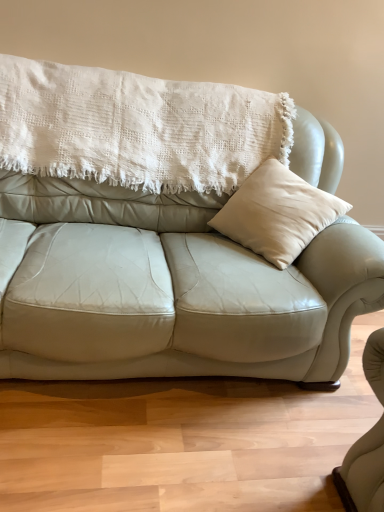
This screenshot has width=384, height=512. What do you see at coordinates (168, 233) in the screenshot?
I see `light beige leather couch at center` at bounding box center [168, 233].

Image resolution: width=384 pixels, height=512 pixels. I want to click on light beige leather couch at center, so click(168, 233).

What do you see at coordinates (137, 128) in the screenshot? The height and width of the screenshot is (512, 384). I see `white textured blanket at upper center` at bounding box center [137, 128].

Where is `white textured blanket at upper center`? The height and width of the screenshot is (512, 384). white textured blanket at upper center is located at coordinates (137, 128).

Where is `light beige leather couch at center`? The image size is (384, 512). light beige leather couch at center is located at coordinates (168, 233).

Is light beige leather couch at center at the right side of white textured blanket at upper center?

Yes.

In the image, is light beige leather couch at center positioned in front of or behind white textured blanket at upper center?

Clearly, light beige leather couch at center is in front of white textured blanket at upper center.

Is point (248, 293) closer to viewer compared to point (252, 168)?

That is True.

From the image's perspective, which is below, light beige leather couch at center or white textured blanket at upper center?

light beige leather couch at center, from the image's perspective.

From a real-world perspective, is light beige leather couch at center under white textured blanket at upper center?

Yes, from a real-world perspective, light beige leather couch at center is under white textured blanket at upper center.

Does light beige leather couch at center have a greater width compared to white textured blanket at upper center?

Yes, light beige leather couch at center is wider than white textured blanket at upper center.

Considering the sizes of objects light beige leather couch at center and white textured blanket at upper center in the image provided, who is taller, light beige leather couch at center or white textured blanket at upper center?

light beige leather couch at center is taller.

Who is smaller, light beige leather couch at center or white textured blanket at upper center?

white textured blanket at upper center.

Do you think light beige leather couch at center is within white textured blanket at upper center, or outside of it?

light beige leather couch at center lies outside white textured blanket at upper center.

Is there a large distance between light beige leather couch at center and white textured blanket at upper center?

That's not correct — light beige leather couch at center is a little close to white textured blanket at upper center.

Is light beige leather couch at center aimed at white textured blanket at upper center?

No, light beige leather couch at center does not turn towards white textured blanket at upper center.

Find the location of a particular element. blanket on the left of light beige leather couch at center is located at coordinates (137, 128).

Can you confirm if white textured blanket at upper center is positioned to the right of light beige leather couch at center?

In fact, white textured blanket at upper center is to the left of light beige leather couch at center.

Who is more distant, white textured blanket at upper center or light beige leather couch at center?

white textured blanket at upper center is further from the camera.

Between point (258, 116) and point (41, 206), which one is positioned in front?

The point (41, 206) is in front.

From the image's perspective, which one is positioned lower, white textured blanket at upper center or light beige leather couch at center?

light beige leather couch at center is shown below in the image.

From a real-world perspective, who is located lower, white textured blanket at upper center or light beige leather couch at center?

In real-world perspective, light beige leather couch at center is lower.

Considering the relative sizes of white textured blanket at upper center and light beige leather couch at center in the image provided, is white textured blanket at upper center thinner than light beige leather couch at center?

Indeed, white textured blanket at upper center has a lesser width compared to light beige leather couch at center.

Does white textured blanket at upper center have a lesser height compared to light beige leather couch at center?

Indeed, white textured blanket at upper center has a lesser height compared to light beige leather couch at center.

Considering the sizes of objects white textured blanket at upper center and light beige leather couch at center in the image provided, who is bigger, white textured blanket at upper center or light beige leather couch at center?

light beige leather couch at center is bigger.

Is white textured blanket at upper center situated inside light beige leather couch at center or outside?

The correct answer is: inside.

Would you consider white textured blanket at upper center to be distant from light beige leather couch at center?

No.

Is white textured blanket at upper center turned away from light beige leather couch at center?

That's right, white textured blanket at upper center is facing away from light beige leather couch at center.

Identify the location of blanket above the light beige leather couch at center (from a real-world perspective). The image size is (384, 512). (137, 128).

This screenshot has width=384, height=512. Find the location of `studio couch that is on the right side of white textured blanket at upper center`. studio couch that is on the right side of white textured blanket at upper center is located at coordinates (168, 233).

The image size is (384, 512). Find the location of `blanket that appears on the left of light beige leather couch at center`. blanket that appears on the left of light beige leather couch at center is located at coordinates (137, 128).